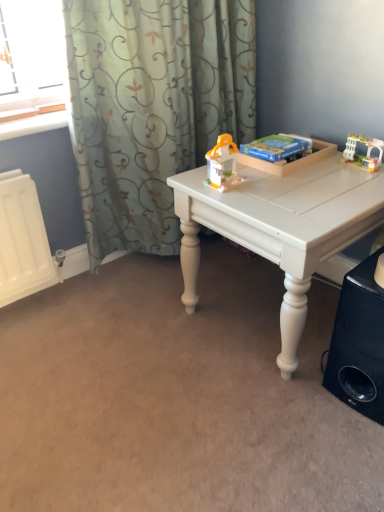
This screenshot has height=512, width=384. I want to click on free space between satin green curtain at upper left and white matte table at center, so click(180, 297).